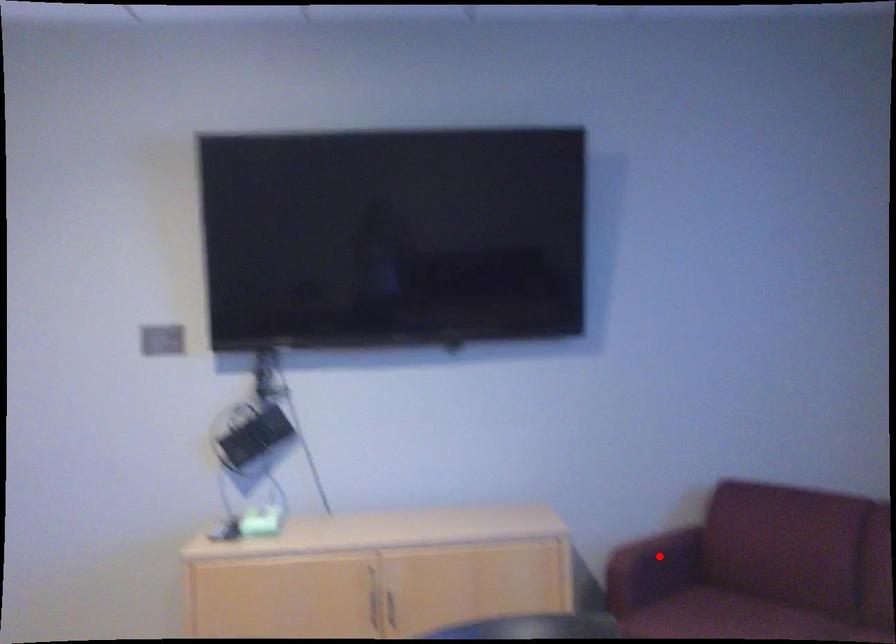
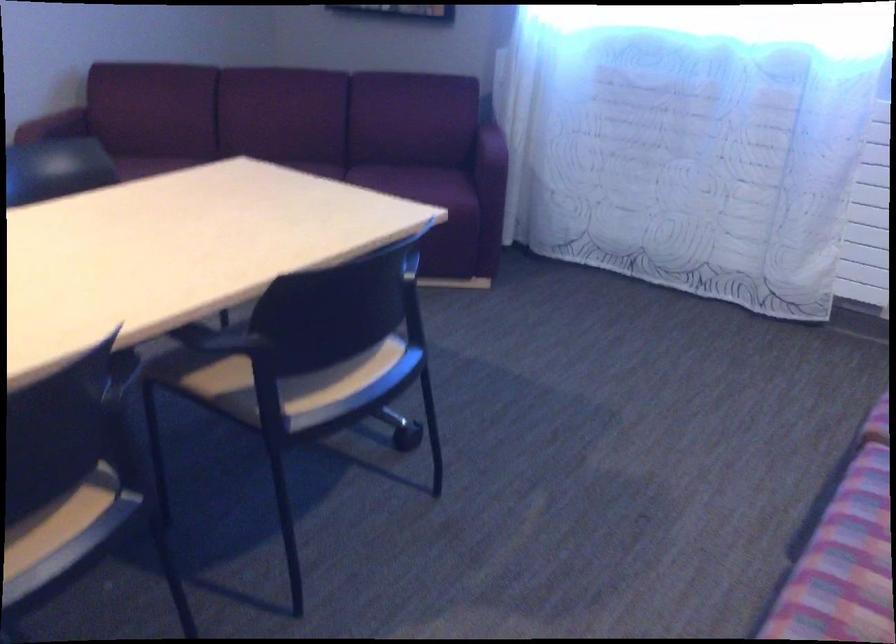
Question: I am providing you with two images of the same scene from different viewpoints. A red point is shown in image1. For the corresponding object point in image2, is it positioned nearer or farther from the camera?

Choices:
 (A) Nearer
 (B) Farther

Answer: (B)